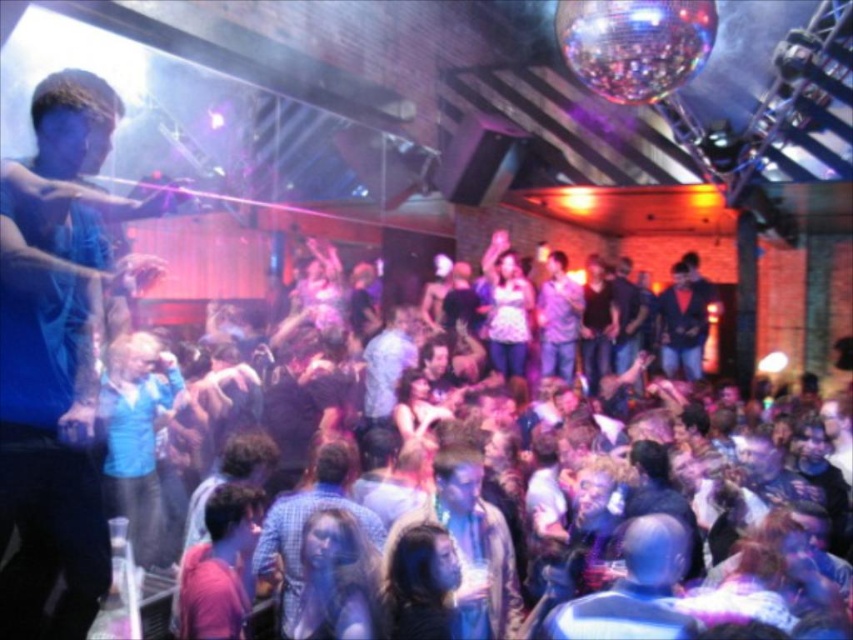
Question: Which object appears closest to the camera in this image?

Choices:
 (A) dark blue jeans at center
 (B) shiny blue suit at center

Answer: (A)

Question: Estimate the real-world distances between objects in this image. Which object is closer to the light brown leather jacket at center?

Choices:
 (A) light brown hair at center
 (B) dark blue jeans at center
 (C) matte purple shirt at center
 (D) shiny blue suit at center

Answer: (A)

Question: Which point appears farthest from the camera in this image?

Choices:
 (A) (314, 563)
 (B) (584, 371)

Answer: (B)

Question: Can you confirm if matte purple shirt at center is positioned above shiny blue suit at center?

Choices:
 (A) no
 (B) yes

Answer: (B)

Question: Is blue matte shirt at center wider than checkered shirt at center?

Choices:
 (A) yes
 (B) no

Answer: (B)

Question: Can you confirm if light brown leather jacket at center is bigger than dark blue jeans at center?

Choices:
 (A) no
 (B) yes

Answer: (A)